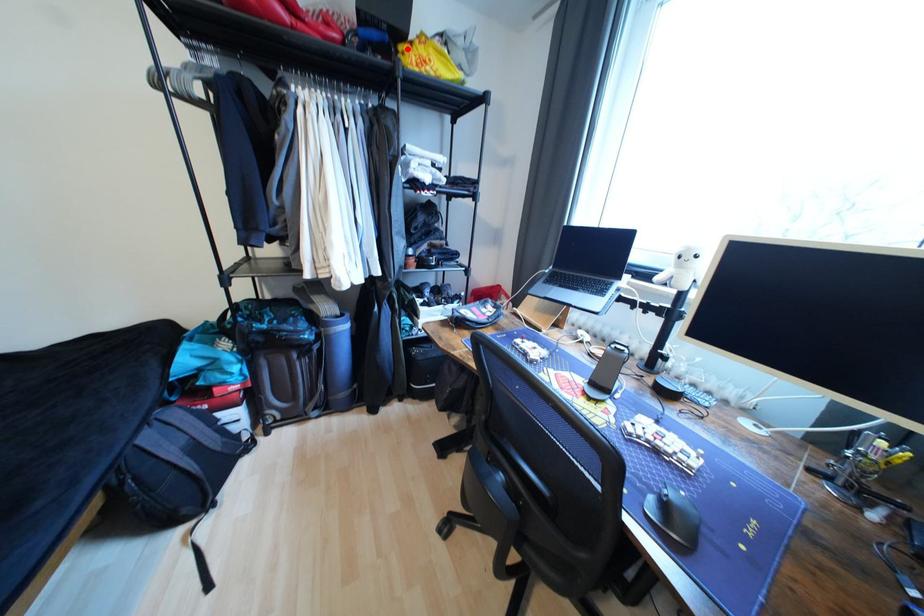
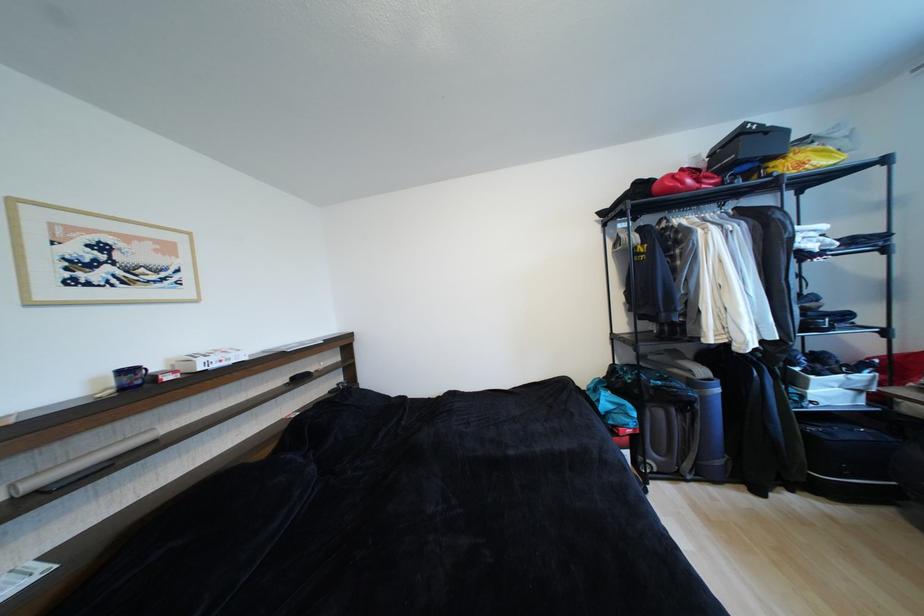
In the second image, find the point that corresponds to the highlighted location in the first image.

(780, 166)